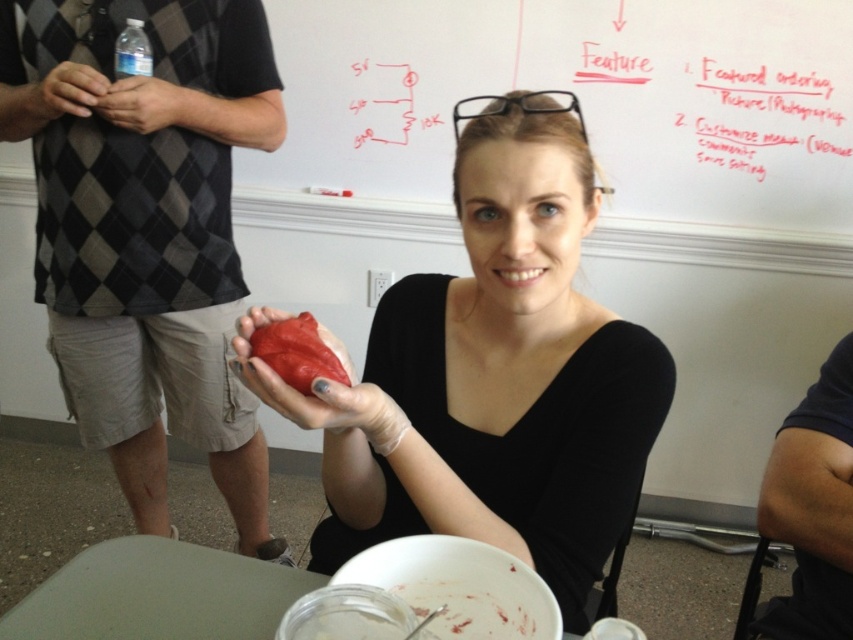
Question: Which point is farther to the camera?

Choices:
 (A) dark blue fabric at right
 (B) rubber heart at center
 (C) rubber-like red heart at center

Answer: (A)

Question: Observing the image, what is the correct spatial positioning of rubber heart at center in reference to clear plastic bottle at upper left?

Choices:
 (A) right
 (B) left

Answer: (A)

Question: Considering the relative positions of white paper at upper center and rubber heart at center in the image provided, where is white paper at upper center located with respect to rubber heart at center?

Choices:
 (A) right
 (B) left

Answer: (A)

Question: Considering the real-world distances, which object is farthest from the clear plastic bottle at upper left?

Choices:
 (A) white paper at upper center
 (B) smooth white table at lower center
 (C) matte black hand at upper left

Answer: (A)

Question: Which object is positioned closest to the matte plastic food at lower center?

Choices:
 (A) matte black hand at upper left
 (B) dark blue fabric at right

Answer: (B)

Question: Does matte plastic food at lower center have a greater width compared to matte black hand at upper left?

Choices:
 (A) yes
 (B) no

Answer: (B)